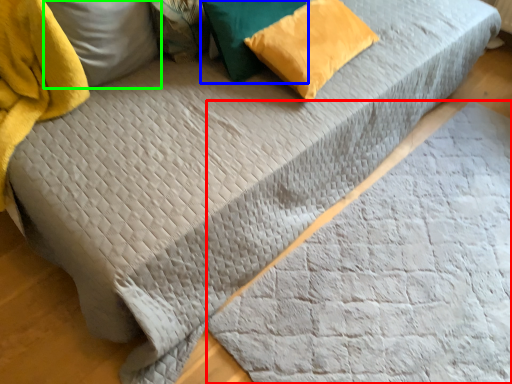
Question: Considering the real-world distances, which object is farthest from blanket (highlighted by a red box)? pillow (highlighted by a blue box) or pillow (highlighted by a green box)?

Choices:
 (A) pillow
 (B) pillow

Answer: (B)